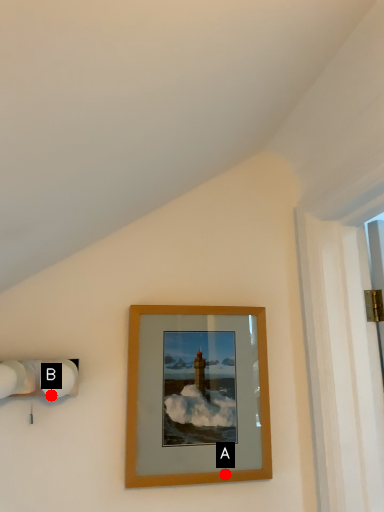
Question: Two points are circled on the image, labeled by A and B beside each circle. Which of the following is the closest to the observer?

Choices:
 (A) A is closer
 (B) B is closer

Answer: (B)